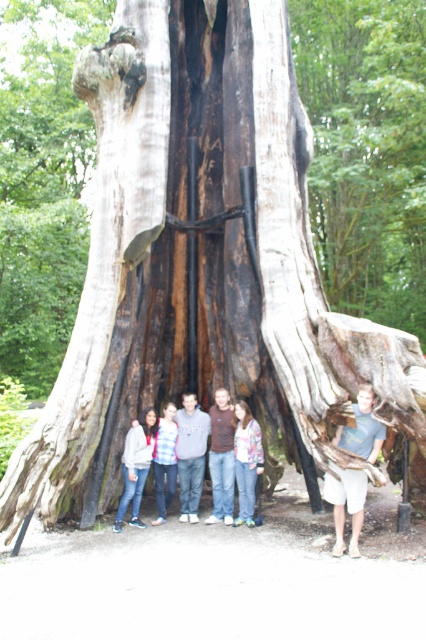
You are a photographer standing in front of the tree. You want to take a photo of the light brown wood at right and the striped sweater at center. How far apart are these two objects in the scene?

The light brown wood at right is 2.03 meters away from the striped sweater at center.

You are standing at the center of the image and want to move towards the matte gray hoodie at lower left. Which direction should you move?

Since the matte gray hoodie at lower left is located at point (x=135, y=465), you should move diagonally to the lower left direction to reach it.